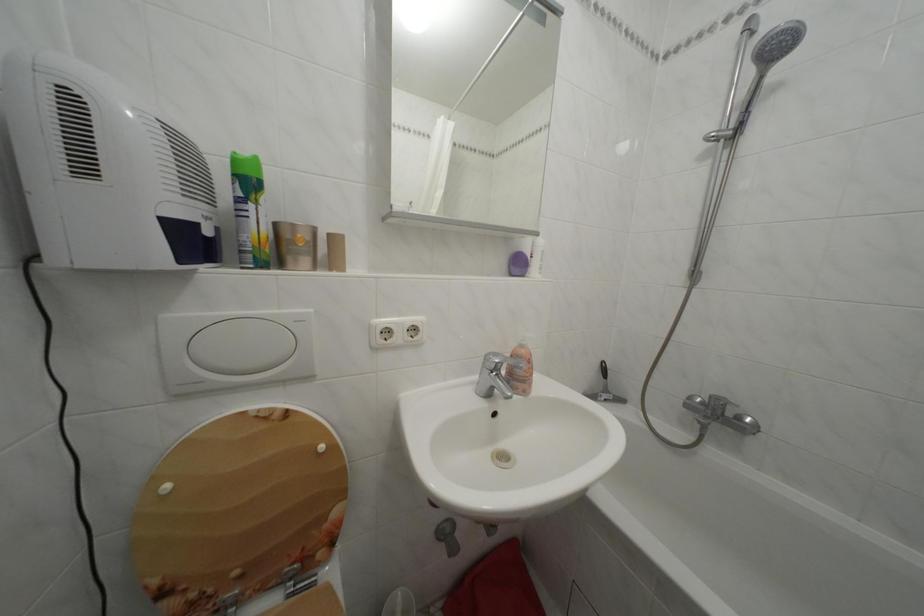
Describe the element at coordinates (742, 120) in the screenshot. I see `the shower control knob` at that location.